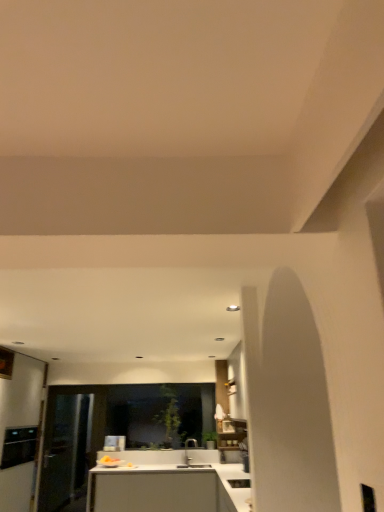
Question: From a real-world perspective, is matte silver faucet at center positioned under black stainless steel oven at left, placed as the second appliance when sorted from right to left, based on gravity?

Choices:
 (A) yes
 (B) no

Answer: (A)

Question: Is matte silver faucet at center further to the viewer compared to black stainless steel oven at left, placed as the second appliance when sorted from right to left?

Choices:
 (A) no
 (B) yes

Answer: (B)

Question: Is black stainless steel oven at left, the second appliance when ordered from front to back, at the back of matte silver faucet at center?

Choices:
 (A) yes
 (B) no

Answer: (B)

Question: Is black stainless steel oven at left, which is the first appliance in back-to-front order, surrounded by matte silver faucet at center?

Choices:
 (A) no
 (B) yes

Answer: (A)

Question: Is matte silver faucet at center oriented towards black stainless steel oven at left, which is the first appliance in back-to-front order?

Choices:
 (A) yes
 (B) no

Answer: (B)

Question: In terms of width, does transparent glass door at left look wider or thinner when compared to white glossy sink at lower center, which appears as the second appliance when viewed from the back?

Choices:
 (A) wide
 (B) thin

Answer: (B)

Question: Is point (51, 415) closer or farther from the camera than point (249, 482)?

Choices:
 (A) closer
 (B) farther

Answer: (B)

Question: Is transparent glass door at left taller or shorter than white glossy sink at lower center, which is the second appliance in left-to-right order?

Choices:
 (A) tall
 (B) short

Answer: (A)

Question: From a real-world perspective, is transparent glass door at left physically located above or below white glossy sink at lower center, which appears as the second appliance when viewed from the back?

Choices:
 (A) above
 (B) below

Answer: (A)

Question: From their relative heights in the image, would you say white glossy countertop at center is taller or shorter than transparent glass door at left?

Choices:
 (A) short
 (B) tall

Answer: (A)

Question: In the image, is white glossy countertop at center positioned in front of or behind transparent glass door at left?

Choices:
 (A) front
 (B) behind

Answer: (A)

Question: Based on their positions, is white glossy countertop at center located to the left or right of transparent glass door at left?

Choices:
 (A) right
 (B) left

Answer: (A)

Question: Is white glossy countertop at center wider or thinner than transparent glass door at left?

Choices:
 (A) thin
 (B) wide

Answer: (B)

Question: Is black stainless steel oven at left, the second appliance when ordered from front to back, taller or shorter than white glossy sink at lower center, which is the second appliance in left-to-right order?

Choices:
 (A) short
 (B) tall

Answer: (B)

Question: Is black stainless steel oven at left, acting as the 1th appliance starting from the left, wider or thinner than white glossy sink at lower center, which is the 1th appliance in front-to-back order?

Choices:
 (A) thin
 (B) wide

Answer: (B)